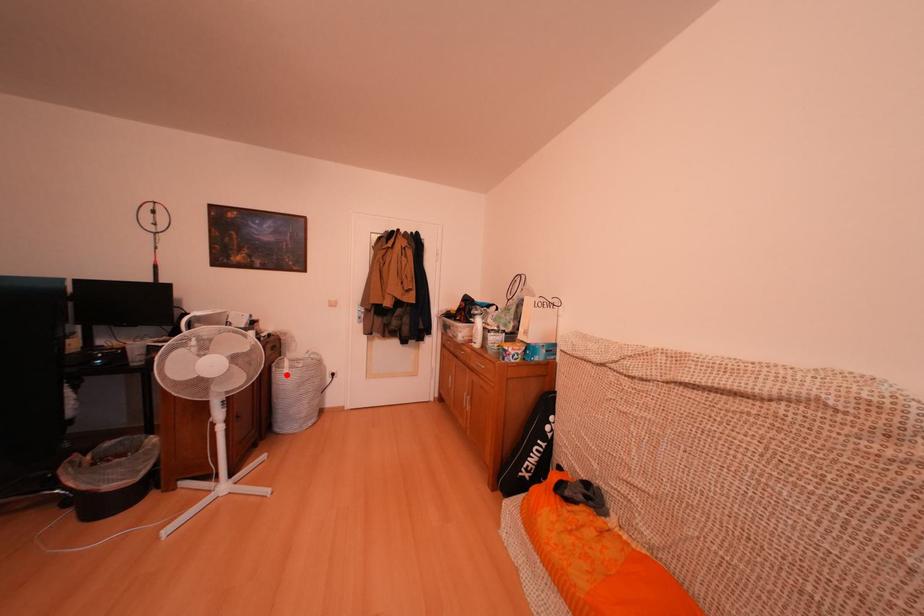
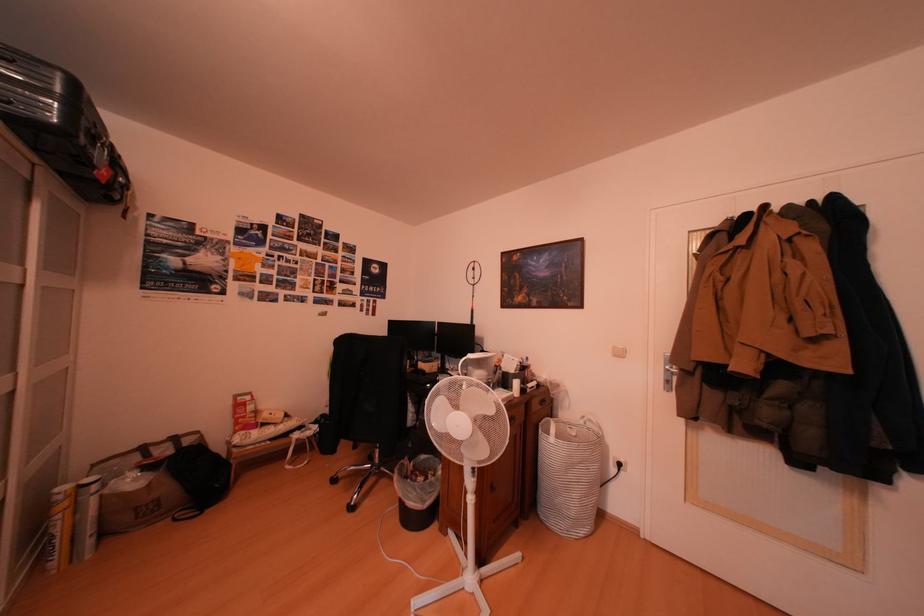
In the second image, find the point that corresponds to the highlighted location in the first image.

(553, 437)